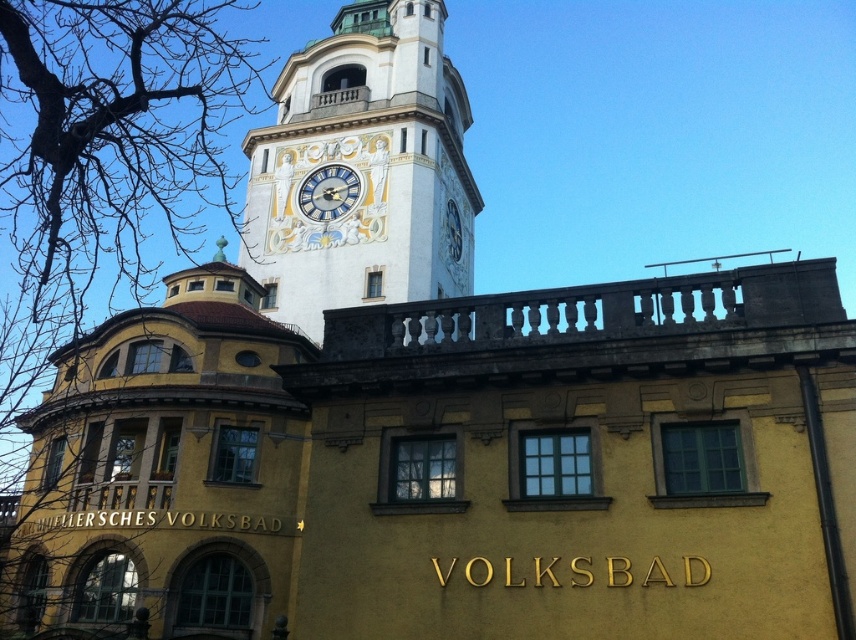
Identify the location of bare branches at upper left. (104, 145).

In order to click on bare branches at upper left in this screenshot , I will do `click(104, 145)`.

Which is above, bare branches at upper left or gold textured clock at center?

bare branches at upper left

Consider the image. Does bare branches at upper left have a smaller size compared to gold textured clock at center?

Actually, bare branches at upper left might be larger than gold textured clock at center.

At what (x,y) coordinates should I click in order to perform the action: click on bare branches at upper left. Please return your answer as a coordinate pair (x, y). Looking at the image, I should click on (104, 145).

This screenshot has width=856, height=640. I want to click on bare branches at upper left, so click(x=104, y=145).

Is white painted stone clock tower at upper center above gold textured clock at center?

Yes.

Measure the distance between white painted stone clock tower at upper center and camera.

white painted stone clock tower at upper center and camera are 54.67 meters apart from each other.

At what (x,y) coordinates should I click in order to perform the action: click on white painted stone clock tower at upper center. Please return your answer as a coordinate pair (x, y). This screenshot has height=640, width=856. Looking at the image, I should click on (364, 168).